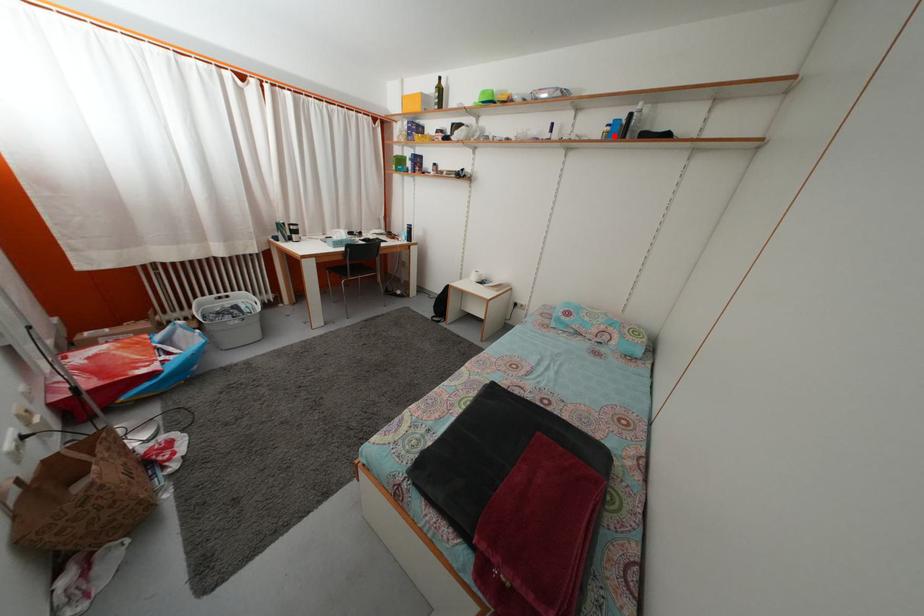
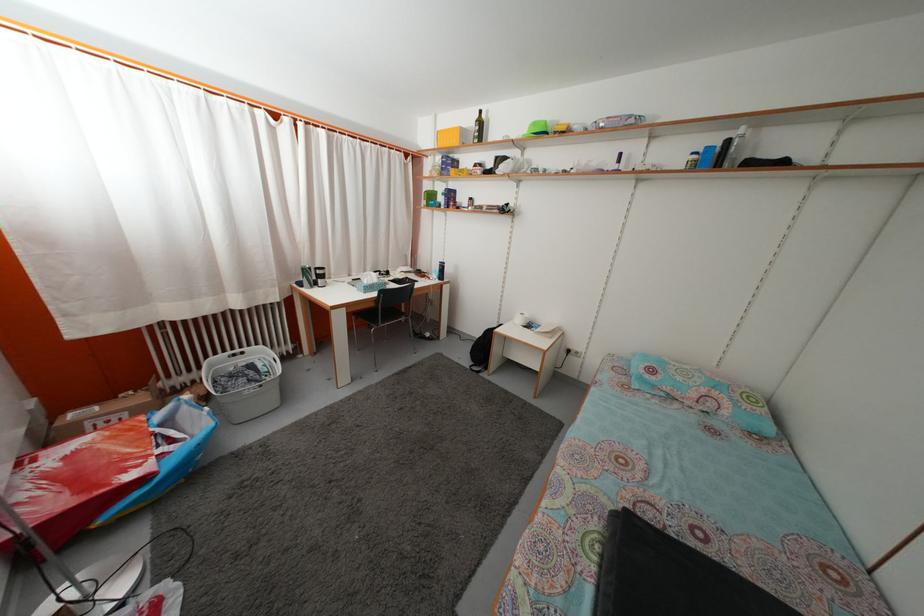
Locate, in the second image, the point that corresponds to the highlighted location in the first image.

(699, 164)